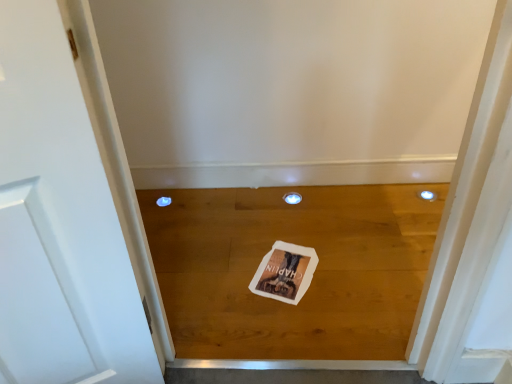
At what (x,y) coordinates should I click in order to perform the action: click on free spot below white paper postcard at center (from a real-world perspective). Please return your answer as a coordinate pair (x, y). Looking at the image, I should click on (285, 267).